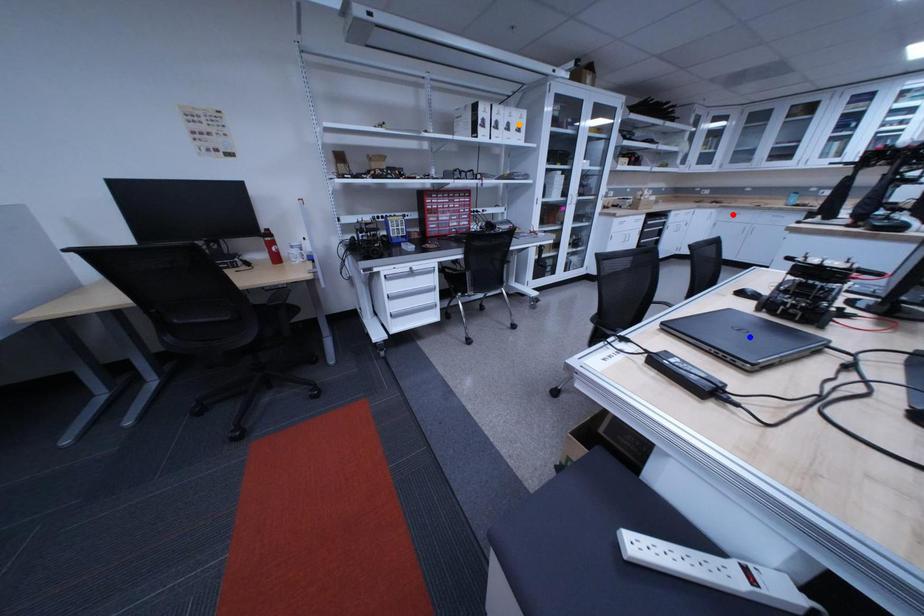
Order these from nearest to farthest:
1. orange point
2. red point
3. blue point

1. blue point
2. orange point
3. red point